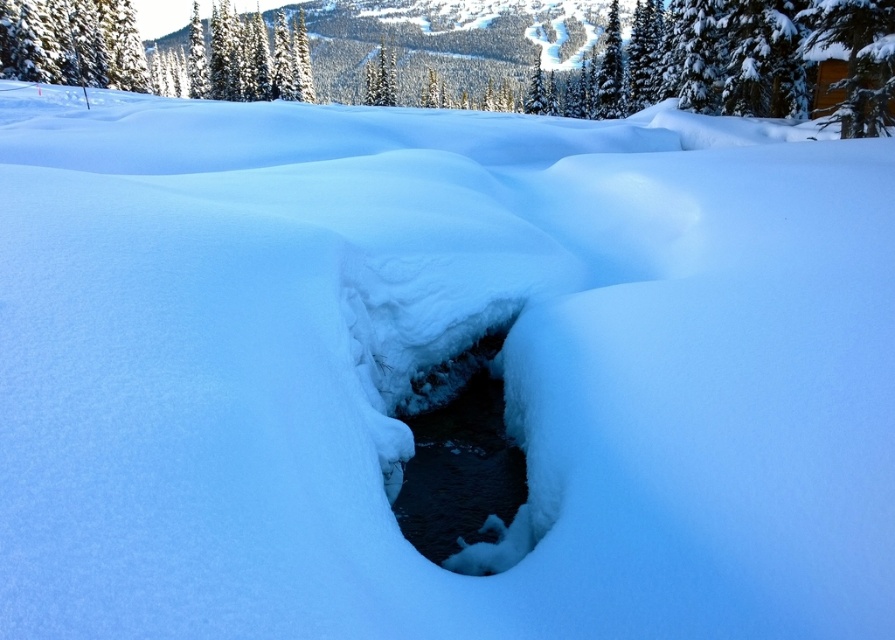
Question: Can you confirm if clear ice hole at center is positioned above green textured tree at upper left?

Choices:
 (A) no
 (B) yes

Answer: (A)

Question: Is clear ice hole at center in front of green textured tree at upper left?

Choices:
 (A) no
 (B) yes

Answer: (B)

Question: Which point is closer to the camera taking this photo?

Choices:
 (A) (411, 504)
 (B) (109, 17)

Answer: (A)

Question: Is clear ice hole at center above green textured tree at upper left?

Choices:
 (A) yes
 (B) no

Answer: (B)

Question: Which point appears farthest from the camera in this image?

Choices:
 (A) (124, 64)
 (B) (513, 540)

Answer: (A)